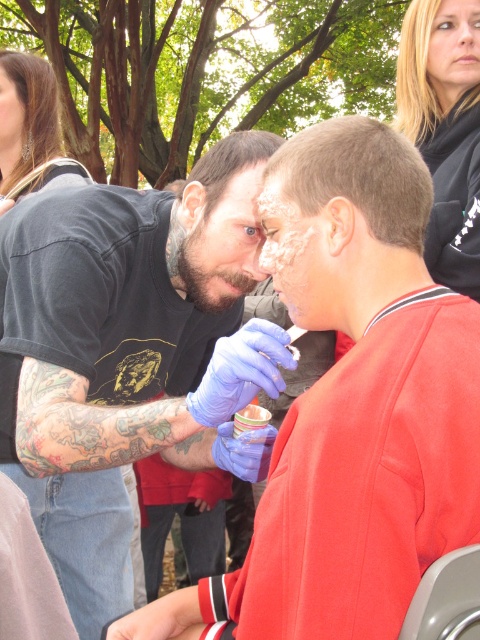
You are a photographer at this event and need to capture a closeup shot of the bearded man at center without the blue latex gloves at center blocking the view. Is this possible given their relative sizes?

The blue latex gloves at center are wider than the bearded man at center, so they might block the view unless positioned carefully.

You are a photographer at this event and want to capture a photo where the blue latex gloves at center and the bearded man at center are both clearly visible. Given their positions, which object should you focus on first to ensure both are in the frame?

The blue latex gloves at center is below the bearded man at center, so focusing on the bearded man at center first will ensure the gloves are also in the frame since they are positioned lower.